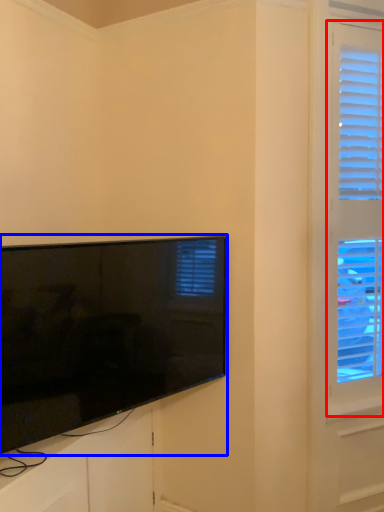
Question: Which point is closer to the camera, window (highlighted by a red box) or television (highlighted by a blue box)?

Choices:
 (A) window
 (B) television

Answer: (B)